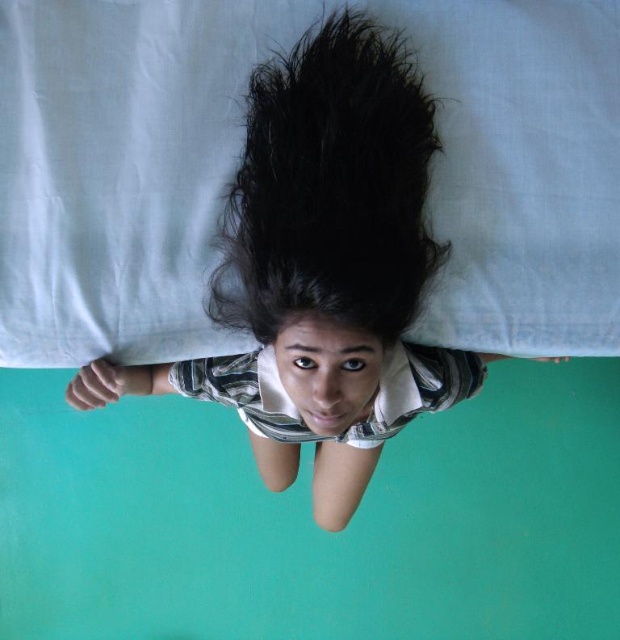
You are a hair stylist trying to style both the smooth black hair at center and the black matte hair at center. Which hair is wider?

The smooth black hair at center is wider than the black matte hair at center.

You are a photographer setting up a shoot in the room described. You need to position a spotlight to highlight the black matte hair at center without illuminating the smooth black hair at center. Given their spatial relationship, is this possible?

The black matte hair at center is behind the smooth black hair at center, so positioning a spotlight in front of the smooth black hair would cast a shadow blocking the black matte hair, making it impossible to illuminate the black matte hair without also lighting the smooth black hair.